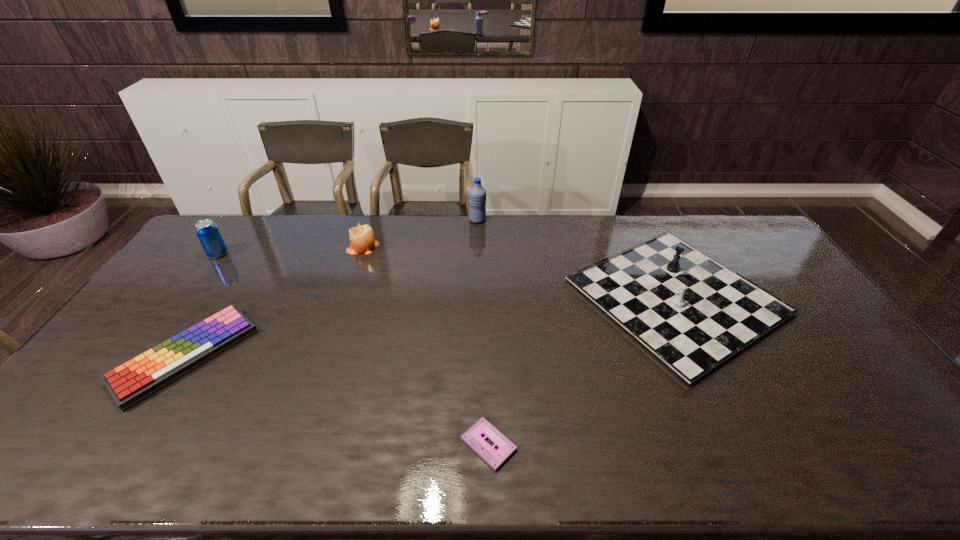
Where is `vacant space located on the front of the candle`? The width and height of the screenshot is (960, 540). vacant space located on the front of the candle is located at coordinates (357, 265).

The image size is (960, 540). I want to click on vacant space located on the left of the gameboard, so click(528, 296).

You are a GUI agent. You are given a task and a screenshot of the screen. Output one action in this format:
    pyautogui.click(x=<x>, y=<y>)
    Task: Click on the free space located on the front of the second shortest object
    This screenshot has height=540, width=960.
    Given the screenshot: What is the action you would take?
    pyautogui.click(x=122, y=458)

Where is `free region located on the back of the videotape`? The width and height of the screenshot is (960, 540). free region located on the back of the videotape is located at coordinates (488, 373).

Where is `water bottle at the far edge`? The height and width of the screenshot is (540, 960). water bottle at the far edge is located at coordinates (477, 194).

Where is `beer can at the far edge`? The height and width of the screenshot is (540, 960). beer can at the far edge is located at coordinates (207, 231).

Where is `candle at the far edge`? candle at the far edge is located at coordinates (362, 239).

Where is `gameboard that is at the far edge`? gameboard that is at the far edge is located at coordinates pos(693,313).

Find the location of a particular element. object at the near edge is located at coordinates (473, 437).

Where is `beer can situated at the left edge`? Image resolution: width=960 pixels, height=540 pixels. beer can situated at the left edge is located at coordinates tap(207, 231).